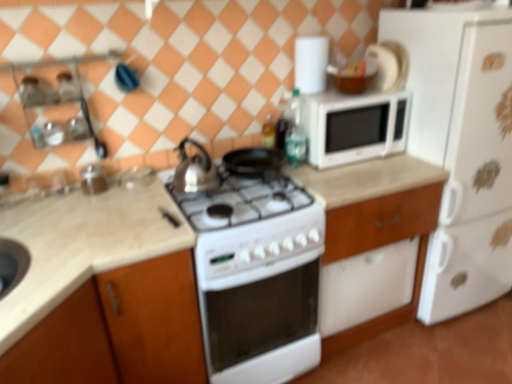
The height and width of the screenshot is (384, 512). Find the location of `vacant area located to the right-hand side of green glass bottle at upper right, marked as the second bottle in a left-to-right arrangement`. vacant area located to the right-hand side of green glass bottle at upper right, marked as the second bottle in a left-to-right arrangement is located at coordinates (338, 166).